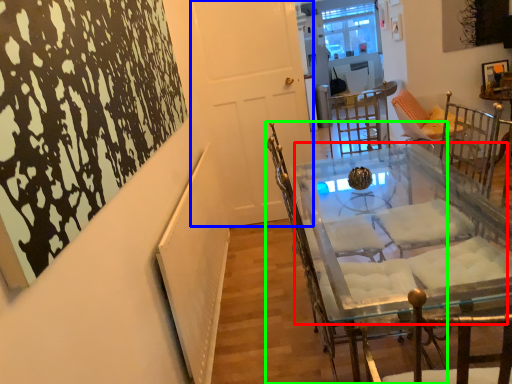
Question: Estimate the real-world distances between objects in this image. Which object is farther from round table (highlighted by a red box), door (highlighted by a blue box) or chair (highlighted by a green box)?

Choices:
 (A) door
 (B) chair

Answer: (A)